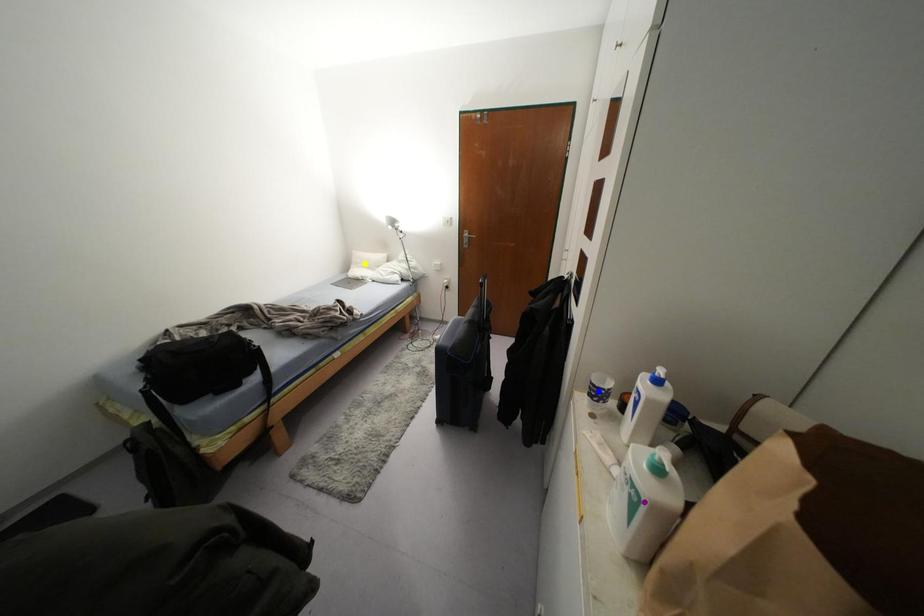
Order these from farthest to nearest:
yellow point, blue point, purple point

yellow point → blue point → purple point